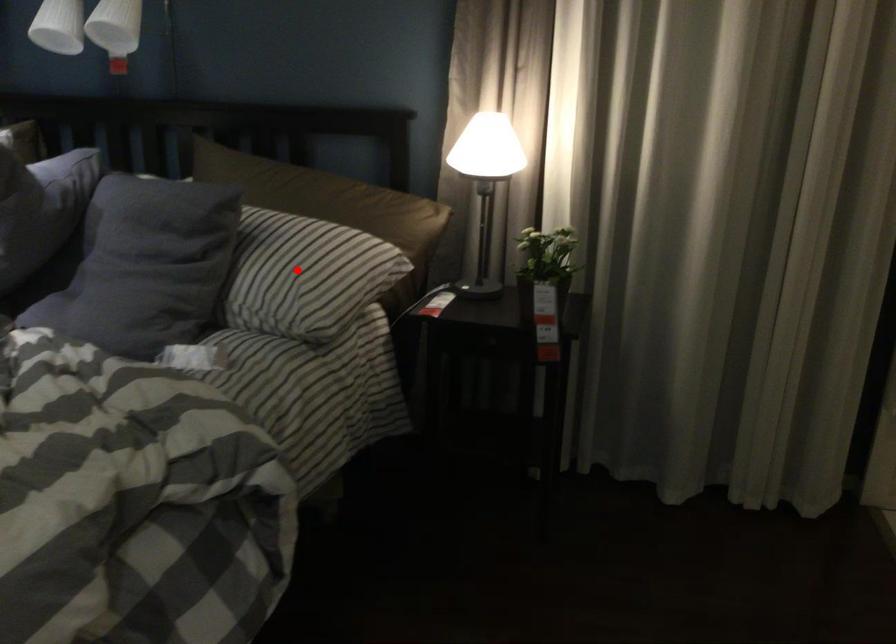
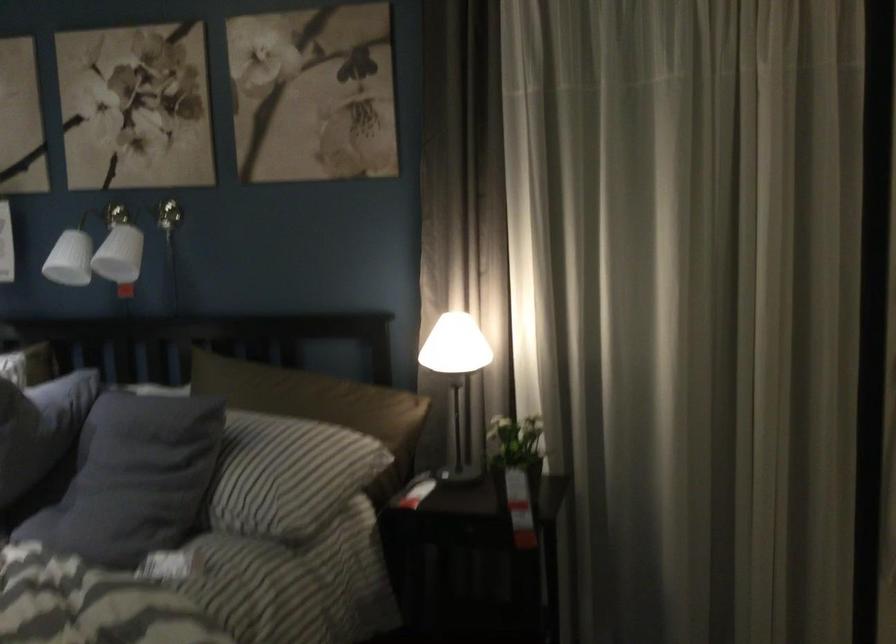
Find the pixel in the second image that matches the highlighted location in the first image.

(280, 471)